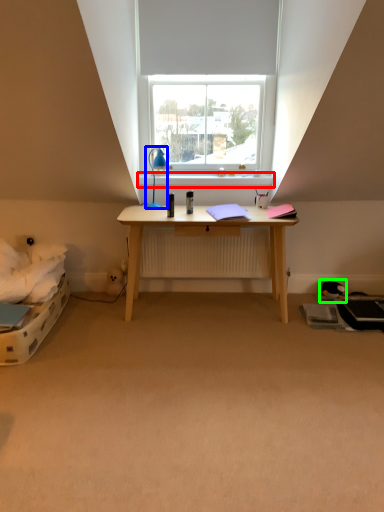
Question: Which object is the closest to the window sill (highlighted by a red box)? Choose among these: lamp (highlighted by a blue box) or toy (highlighted by a green box).

Choices:
 (A) lamp
 (B) toy

Answer: (A)